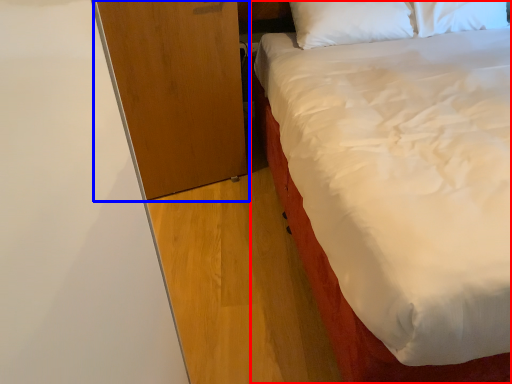
Question: Among these objects, which one is nearest to the camera, bed (highlighted by a red box) or dresser (highlighted by a blue box)?

Choices:
 (A) bed
 (B) dresser

Answer: (A)